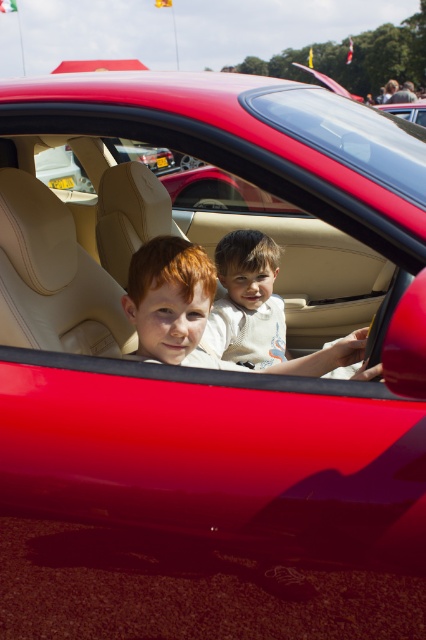
Question: Where is light beige leather child at center located in relation to glossy red car at upper center in the image?

Choices:
 (A) right
 (B) left

Answer: (B)

Question: Can you confirm if light beige leather child at center is positioned above glossy red car at upper center?

Choices:
 (A) no
 (B) yes

Answer: (A)

Question: Among these objects, which one is nearest to the camera?

Choices:
 (A) light beige leather child at center
 (B) glossy red car at upper center

Answer: (B)

Question: Which point is farther to the camera?

Choices:
 (A) (328, 368)
 (B) (422, 102)

Answer: (B)

Question: Can you confirm if light beige leather child at center is positioned above glossy red car at upper center?

Choices:
 (A) yes
 (B) no

Answer: (B)

Question: Which of the following is the closest to the observer?

Choices:
 (A) (408, 116)
 (B) (229, 317)

Answer: (B)